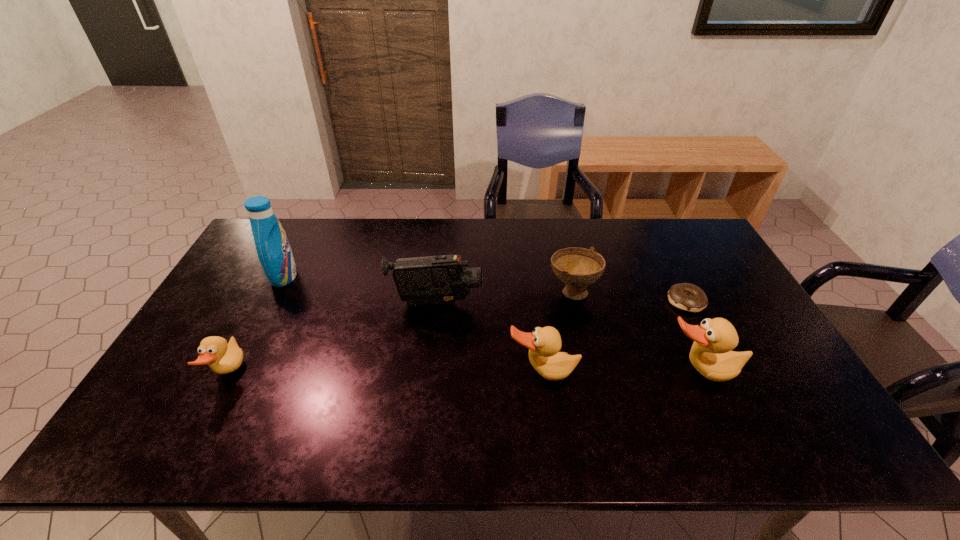
Find the location of a particular element. This screenshot has width=960, height=540. the leftmost duck is located at coordinates (223, 358).

The width and height of the screenshot is (960, 540). Identify the location of the second tallest duck. (544, 344).

You are a GUI agent. You are given a task and a screenshot of the screen. Output one action in this format:
    pyautogui.click(x=<x>, y=<y>)
    Task: Click on the rightmost duck
    This screenshot has width=960, height=540.
    Given the screenshot: What is the action you would take?
    pyautogui.click(x=711, y=355)

The image size is (960, 540). Find the location of `the tallest object`. the tallest object is located at coordinates (274, 252).

The width and height of the screenshot is (960, 540). I want to click on the shortest object, so click(686, 296).

I want to click on camcorder, so click(431, 280).

Locate an element on the screen. The width and height of the screenshot is (960, 540). soup bowl is located at coordinates (577, 267).

Find the location of a particular element. vacant region located on the beak of the shortest duck is located at coordinates (362, 374).

This screenshot has width=960, height=540. I want to click on free location located on the beak of the rightmost duck, so click(716, 409).

The image size is (960, 540). What are the coordinates of `vacant area situated on the front-facing side of the detergent` in the screenshot? It's located at (346, 276).